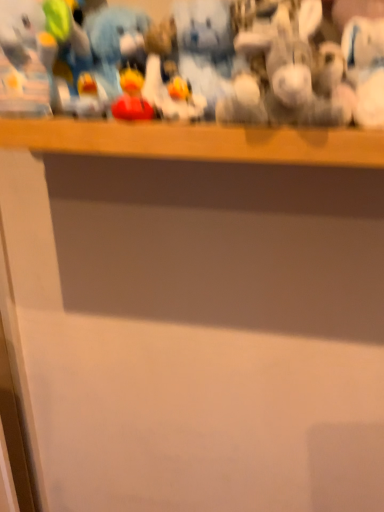
Question: Is fuzzy plush toy at center, marked as the first toy in a back-to-front arrangement, taller than matte plastic toy at center, which is the 1th toy in front-to-back order?

Choices:
 (A) yes
 (B) no

Answer: (A)

Question: From the image's perspective, would you say fuzzy plush toy at center, placed as the second toy when sorted from front to back, is shown under matte plastic toy at center, arranged as the 1th toy when ordered from the bottom?

Choices:
 (A) yes
 (B) no

Answer: (B)

Question: From a real-world perspective, is fuzzy plush toy at center, acting as the second toy starting from the bottom, physically below matte plastic toy at center, the 2th toy in the back-to-front sequence?

Choices:
 (A) yes
 (B) no

Answer: (B)

Question: Is fuzzy plush toy at center, arranged as the 2th toy when viewed from the left, in contact with matte plastic toy at center, which is the second toy from top to bottom?

Choices:
 (A) yes
 (B) no

Answer: (B)

Question: Would you say fuzzy plush toy at center, arranged as the 2th toy when viewed from the left, is outside matte plastic toy at center, marked as the 2th toy in a right-to-left arrangement?

Choices:
 (A) yes
 (B) no

Answer: (A)

Question: Would you say matte plastic toy at center, which is the 1th toy in front-to-back order, is part of fuzzy plush toy at center, marked as the first toy in a back-to-front arrangement,'s contents?

Choices:
 (A) no
 (B) yes

Answer: (A)

Question: Is matte plastic toy at center, which is the second toy from top to bottom, bigger than fuzzy plush toy at center, positioned as the first toy in right-to-left order?

Choices:
 (A) yes
 (B) no

Answer: (B)

Question: Is matte plastic toy at center, arranged as the 1th toy when ordered from the bottom, facing away from fuzzy plush toy at center, positioned as the first toy in right-to-left order?

Choices:
 (A) yes
 (B) no

Answer: (B)

Question: Can you confirm if matte plastic toy at center, which is the 1th toy in front-to-back order, is positioned to the left of fuzzy plush toy at center, the first toy from the top?

Choices:
 (A) yes
 (B) no

Answer: (A)

Question: Can you see matte plastic toy at center, which is the 1th toy in front-to-back order, touching fuzzy plush toy at center, arranged as the 2th toy when viewed from the left?

Choices:
 (A) no
 (B) yes

Answer: (A)

Question: Considering the relative positions of matte plastic toy at center, the 1th toy from the left, and fuzzy plush toy at center, the first toy from the top, in the image provided, is matte plastic toy at center, the 1th toy from the left, to the right of fuzzy plush toy at center, the first toy from the top, from the viewer's perspective?

Choices:
 (A) no
 (B) yes

Answer: (A)

Question: Is matte plastic toy at center, which is the second toy from top to bottom, shorter than fuzzy plush toy at center, the first toy from the top?

Choices:
 (A) no
 (B) yes

Answer: (B)

Question: From a real-world perspective, relative to matte plastic toy at center, which is the second toy from top to bottom, is fuzzy plush toy at center, arranged as the 2th toy when viewed from the left, vertically above or below?

Choices:
 (A) above
 (B) below

Answer: (A)